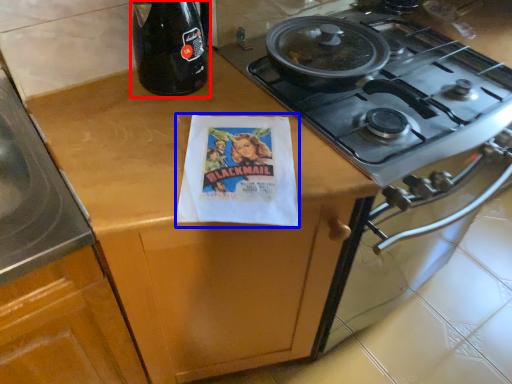
Question: Among these objects, which one is nearest to the camera, bottle (highlighted by a red box) or flyer (highlighted by a blue box)?

Choices:
 (A) bottle
 (B) flyer

Answer: (B)